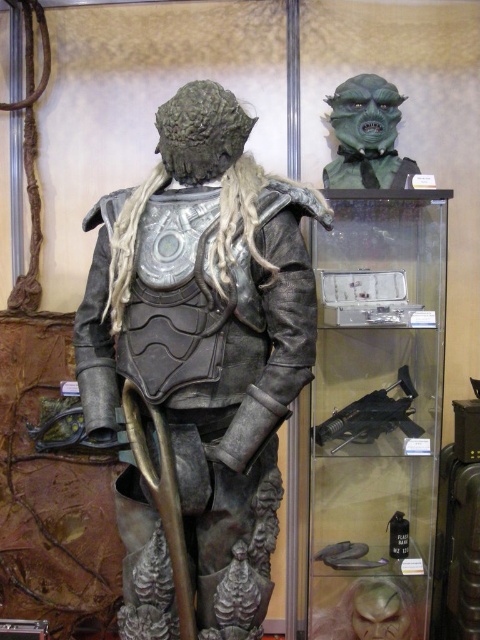
You are an art curator examining the display. You need to place a protective cloth over the bronze armor at center and the green matte mask at upper center. Which object should you cover first to avoid blocking the view of the other?

You should cover the bronze armor at center first because it is located below the green matte mask at upper center, so covering the lower one first would prevent blocking the view of the upper mask.